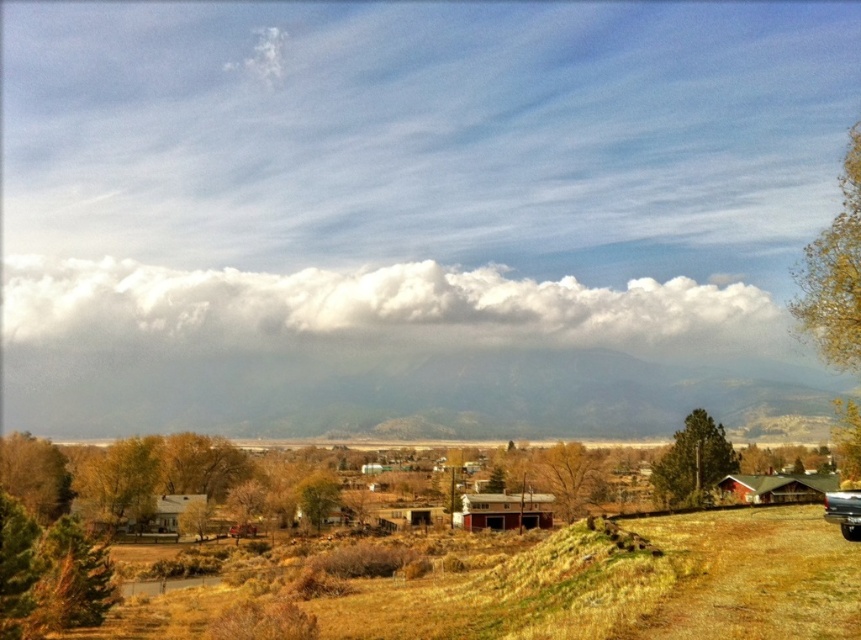
Question: Considering the real-world distances, which object is farthest from the brown grassy field at center?

Choices:
 (A) yellow leafy tree at upper right
 (B) shiny silver truck at lower right

Answer: (A)

Question: Can you confirm if green matte tree at center-right is positioned below green matte tree at center?

Choices:
 (A) yes
 (B) no

Answer: (B)

Question: Does white fluffy cloud at upper center have a larger size compared to brown textured tree at center?

Choices:
 (A) yes
 (B) no

Answer: (A)

Question: Can you confirm if yellow leafy tree at lower left is positioned to the right of green leafy tree at lower left?

Choices:
 (A) no
 (B) yes

Answer: (B)

Question: Which object appears farthest from the camera in this image?

Choices:
 (A) shiny silver truck at lower right
 (B) yellow leafy tree at lower left

Answer: (B)

Question: Among these objects, which one is farthest from the camera?

Choices:
 (A) brown grassy field at center
 (B) green leafy tree at lower left
 (C) brown textured tree at center
 (D) yellow leafy tree at upper right

Answer: (C)